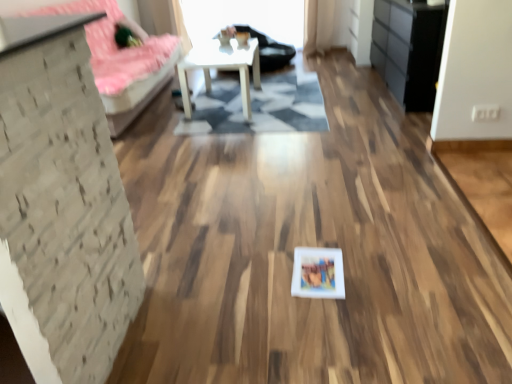
Where is `spots to the right of matte white picture frame at center`? spots to the right of matte white picture frame at center is located at coordinates (370, 270).